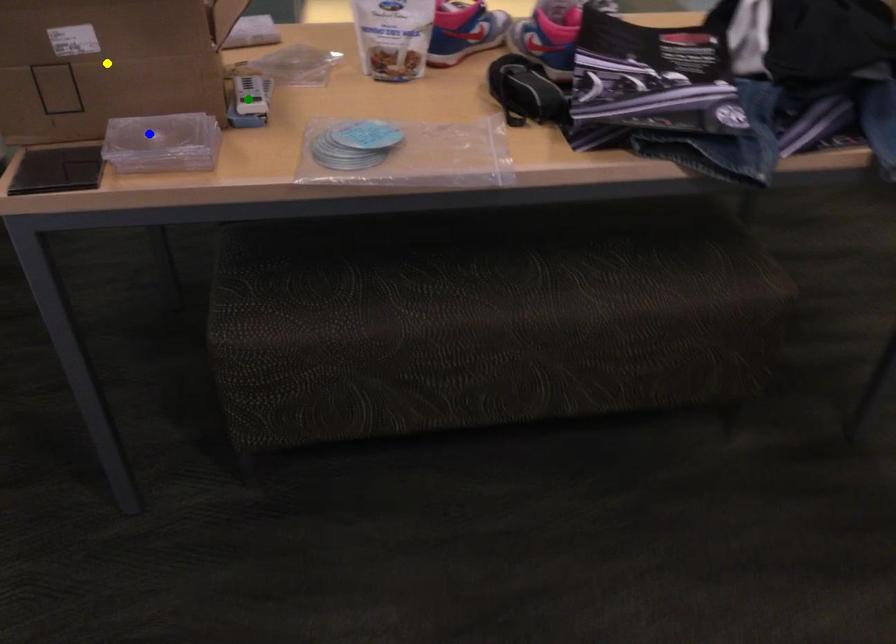
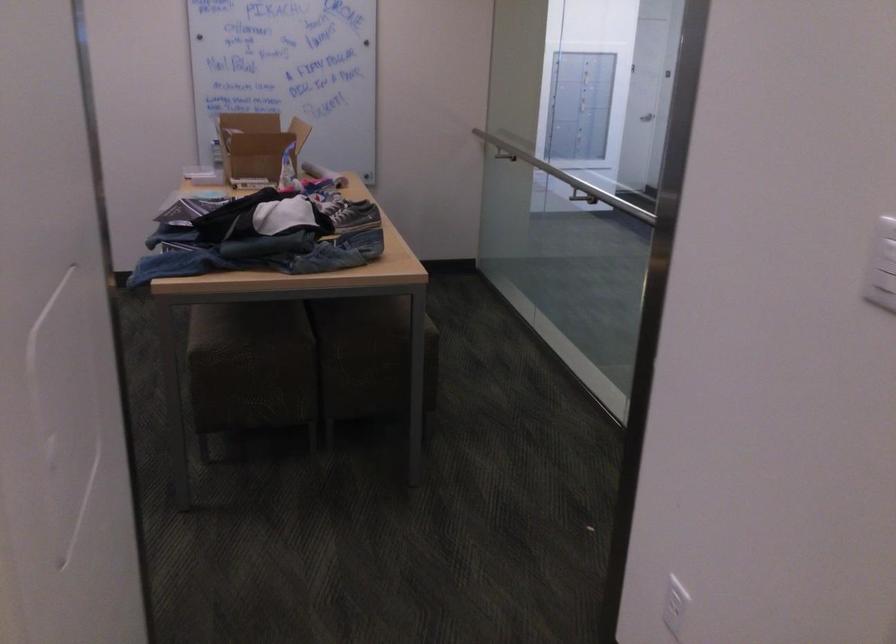
I am providing you with two images of the same scene from different viewpoints. Three points are marked in image1. Which point corresponds to a part or object that is occluded in image2?In image1, three points are marked. Which of them correspond to a part or object that is occluded in image2?Among the three points shown in image1, which one corresponds to a part or object that is no longer visible due to occlusion in image2?

blue point, green point, yellow point